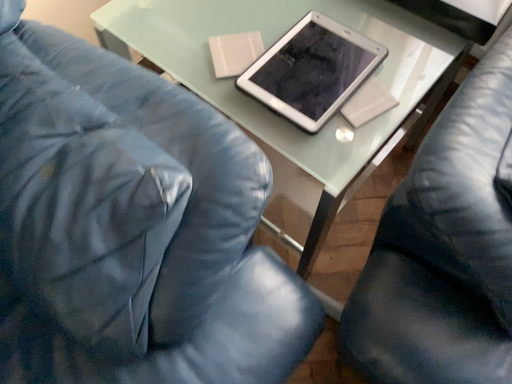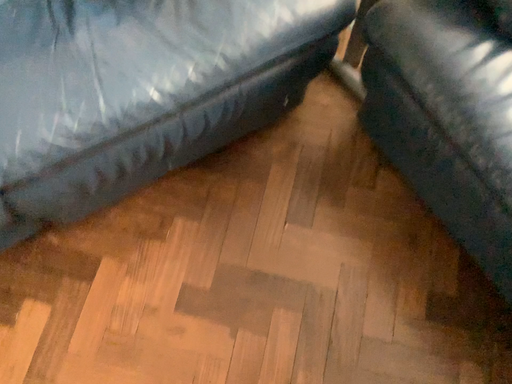
Question: How did the camera likely rotate when shooting the video?

Choices:
 (A) rotated right
 (B) rotated left

Answer: (B)